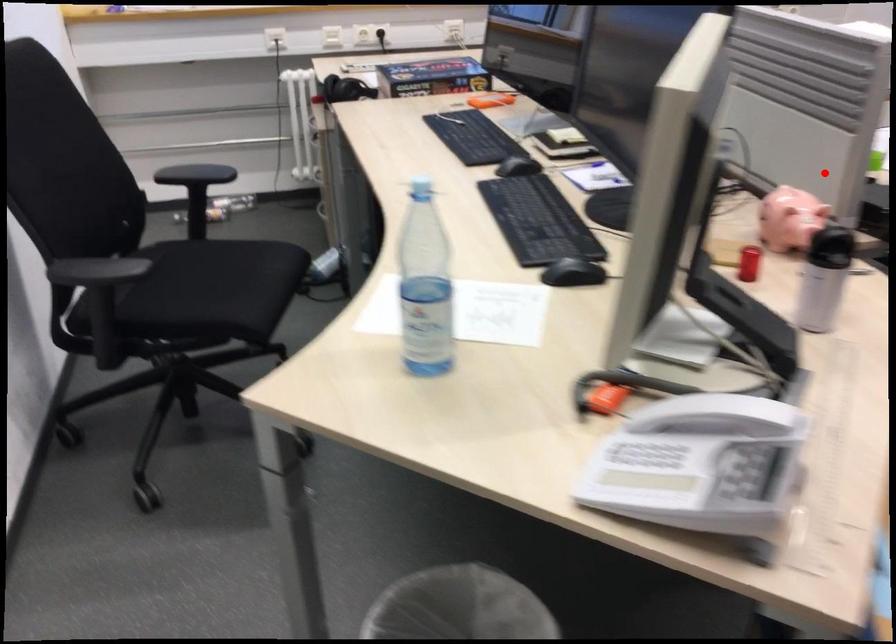
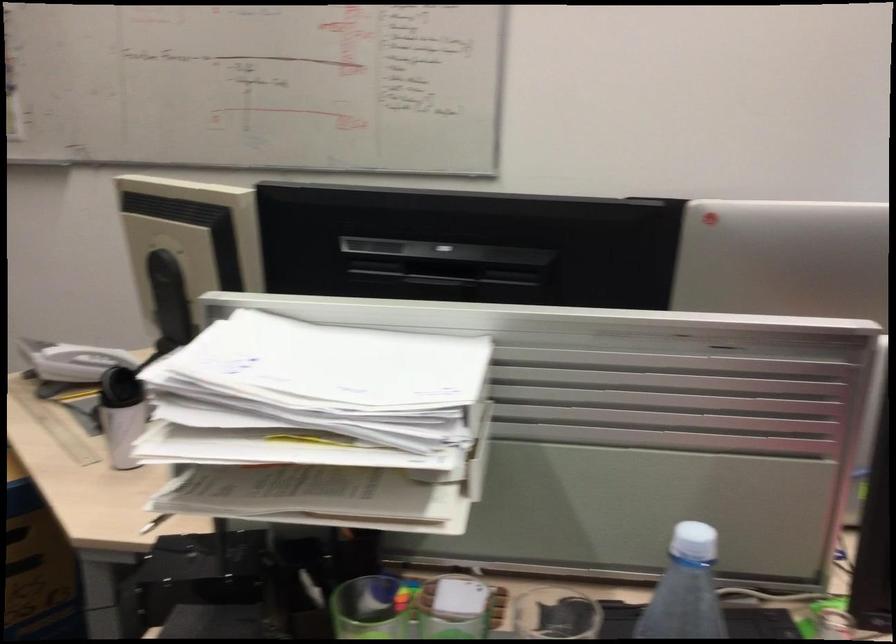
Where in the second image is the point corresponding to the highlighted location from the first image?

(367, 609)